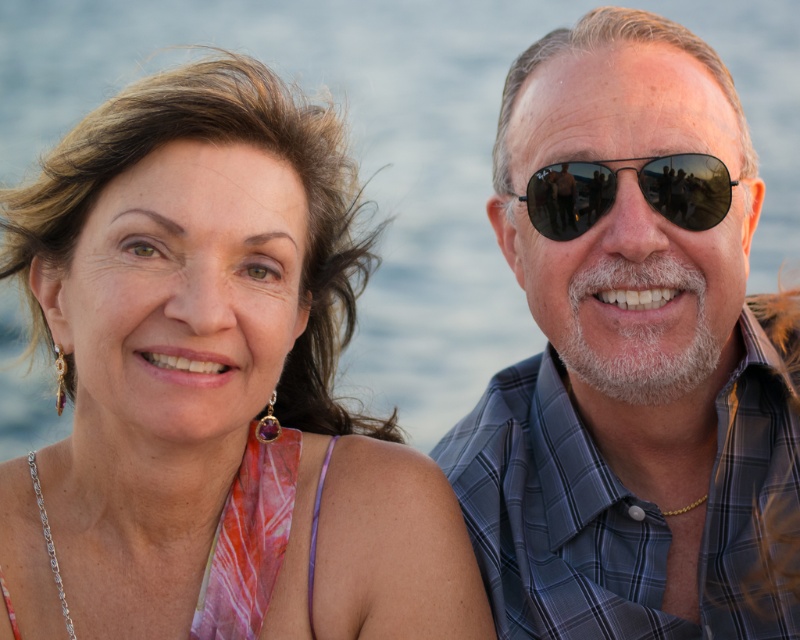
Question: Among these objects, which one is farthest from the camera?

Choices:
 (A) transparent water at center
 (B) matte gold earrings at upper left
 (C) matte black sunglasses at right
 (D) black reflective sunglasses at right

Answer: (A)

Question: Does matte black sunglasses at right have a larger size compared to black reflective sunglasses at right?

Choices:
 (A) yes
 (B) no

Answer: (A)

Question: Which point is closer to the camera?

Choices:
 (A) (474, 440)
 (B) (449, 612)
 (C) (568, 218)

Answer: (B)

Question: Observing the image, what is the correct spatial positioning of matte gold earrings at upper left in reference to black reflective sunglasses at right?

Choices:
 (A) above
 (B) below

Answer: (B)

Question: Is matte gold earrings at upper left behind transparent water at center?

Choices:
 (A) no
 (B) yes

Answer: (A)

Question: Which point is farther from the camera taking this photo?

Choices:
 (A) (176, 48)
 (B) (658, 157)

Answer: (A)